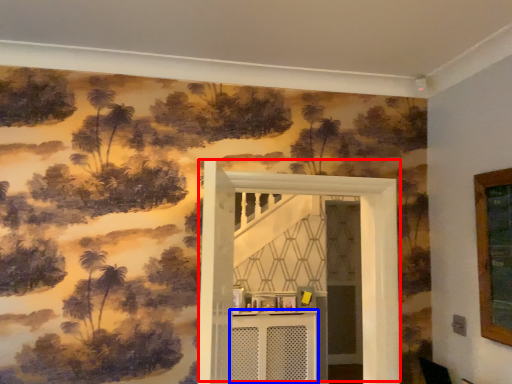
Question: Which point is further to the camera, door (highlighted by a red box) or table (highlighted by a blue box)?

Choices:
 (A) door
 (B) table

Answer: (B)